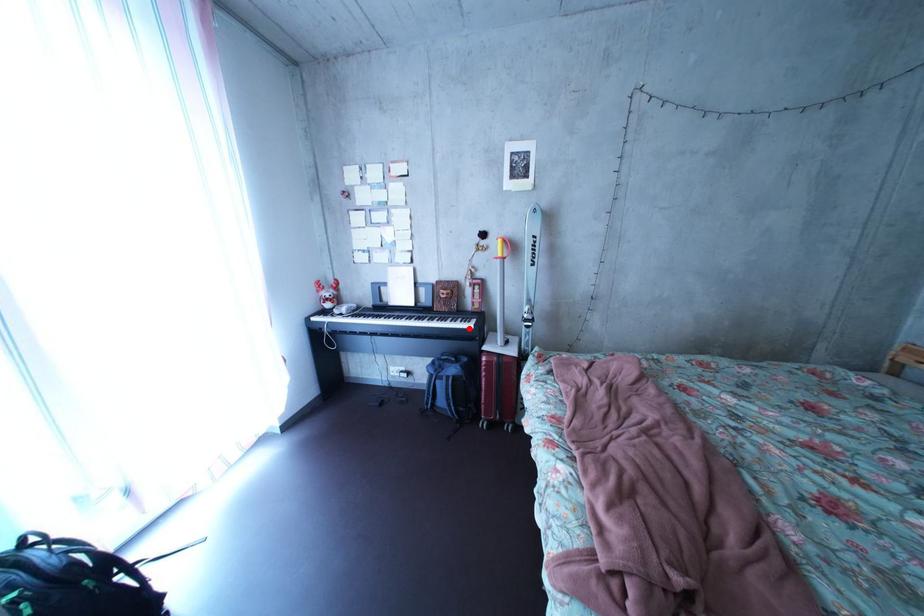
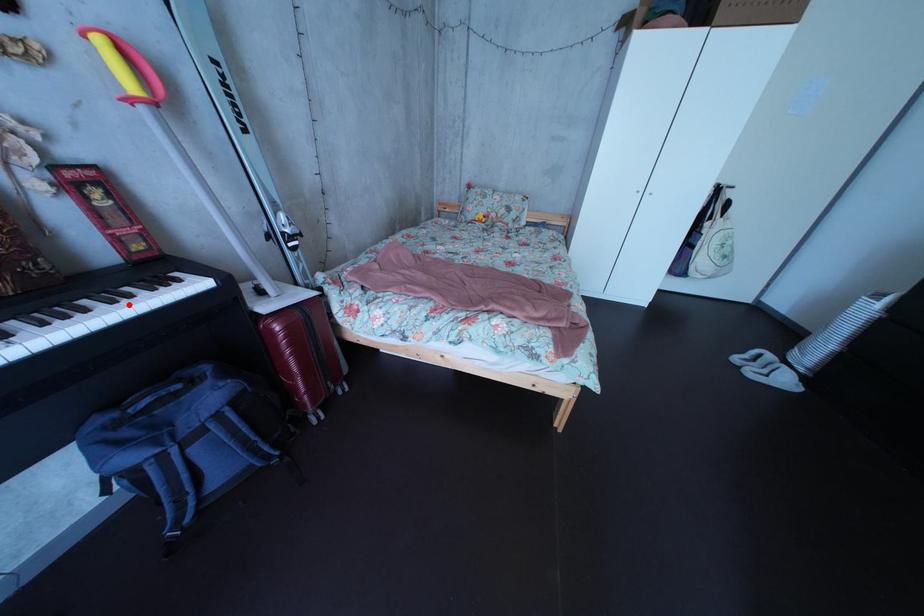
I am providing you with two images of the same scene from different viewpoints. A red point is marked on the first image and another point is marked on the second image. Is the marked point in image1 the same physical position as the marked point in image2?

Yes